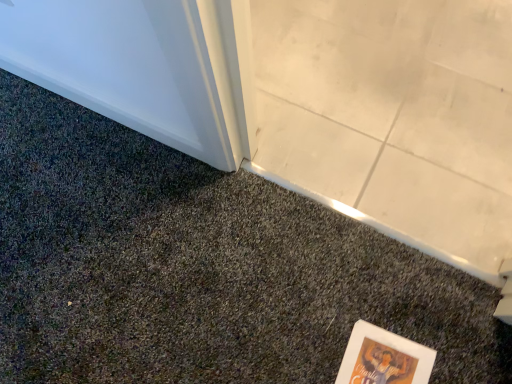
Image resolution: width=512 pixels, height=384 pixels. What do you see at coordinates (131, 66) in the screenshot? I see `white glossy door at upper left` at bounding box center [131, 66].

Find the location of a particular element. white glossy door at upper left is located at coordinates (131, 66).

At what (x,y) coordinates should I click in order to perform the action: click on white glossy door at upper left. Please return your answer as a coordinate pair (x, y). The image size is (512, 384). Looking at the image, I should click on (131, 66).